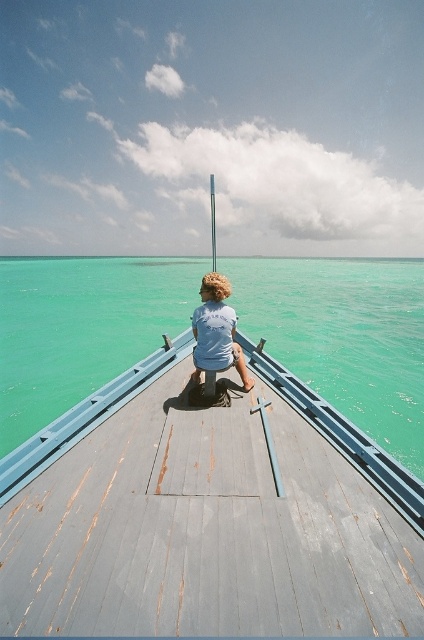
You are standing on the deck of the boat and want to reach both the point closer to you and the point further away. Which of the two points, point (195,563) or point (329,381), will you reach first if you move forward from your current position?

You will reach point (195,563) first because it is closer to you than point (329,381).

You are standing on the rusty wood dock at center and want to reach the light blue fabric shirt at center. Which direction should you move to get closer to the shirt?

The rusty wood dock at center is positioned on the left side of light blue fabric shirt at center. To reach the shirt, you should move to the right.

You are standing on the rusty wood dock at center and want to reach the light blue fabric shirt at center. Which direction should you move to get closer to the shirt?

Since the rusty wood dock at center is closer to the viewer than the light blue fabric shirt at center, you should move forward towards the shirt to get closer.